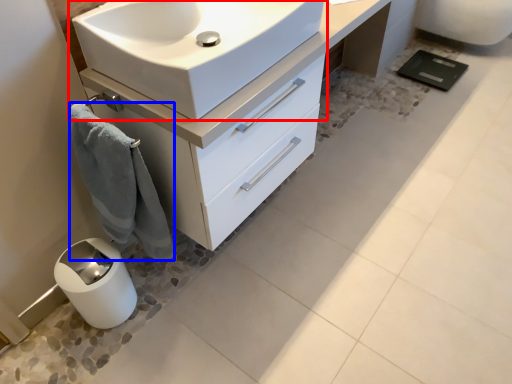
Question: Which point is closer to the camera, sink (highlighted by a red box) or bath towel (highlighted by a blue box)?

Choices:
 (A) sink
 (B) bath towel

Answer: (A)